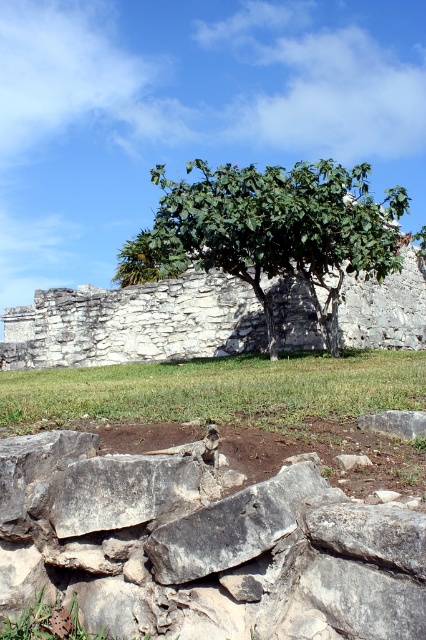
You are standing in front of the stone wall and want to place a small statue between the gray rough stone at center and the white stone ruins at center. Which object should the statue be placed closer to in order to maintain the natural arrangement of the scene?

The statue should be placed closer to the gray rough stone at center because it is closer to the viewer than the white stone ruins at center, maintaining the natural arrangement where closer elements are prioritized.

You are an archaeologist examining the gray rough stone at center and the white stone ruins at center. Which stone is located to the right of the other?

The gray rough stone at center is positioned on the right side of white stone ruins at center.

You are standing at the origin point in the scene. Which direction should you move to reach the green leafy tree at center?

The green leafy tree at center is located at coordinates point (271,230), so you should move towards the center of the scene to reach it.